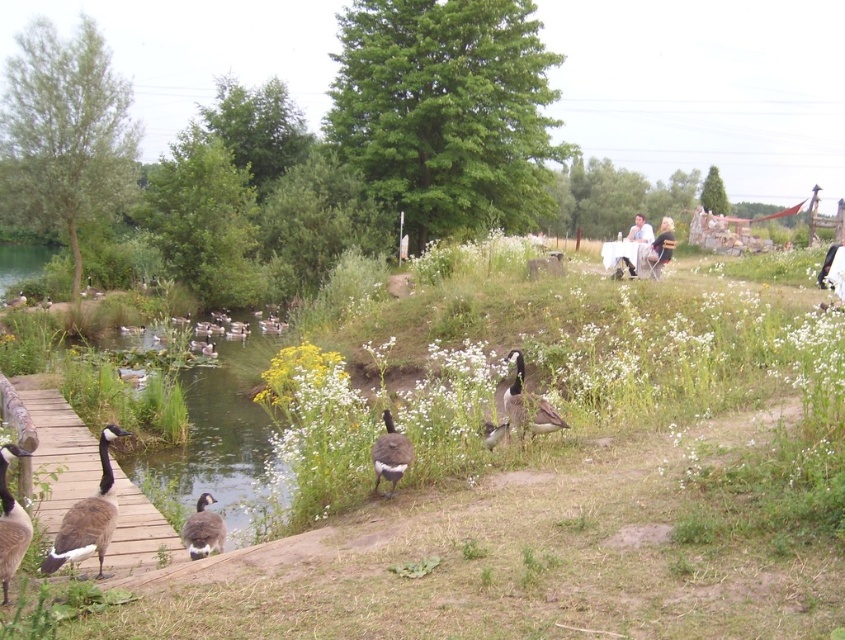
You are standing on the wooden walkway and see two points marked in the scene. Which point is closer to you, point (x=12, y=276) or point (x=221, y=529)?

Point (x=12, y=276) is closer to you because it is further to the viewer than point (x=221, y=529).

You are a bird watcher observing the scene. You see the green grassy water at left and the gray matte duck at lower left. Which object is located to the left of the other?

The green grassy water at left is positioned on the left side of gray matte duck at lower left, so the green grassy water at left is to the left of the gray matte duck at lower left.

You are a small toy boat that is 1 meter long. You want to sail from the gray matte duck at lower left to the green grassy water at left. Is there enough space for you to move between them?

The green grassy water at left might be wider than gray matte duck at lower left, so there might be enough space for the boat to move between them.